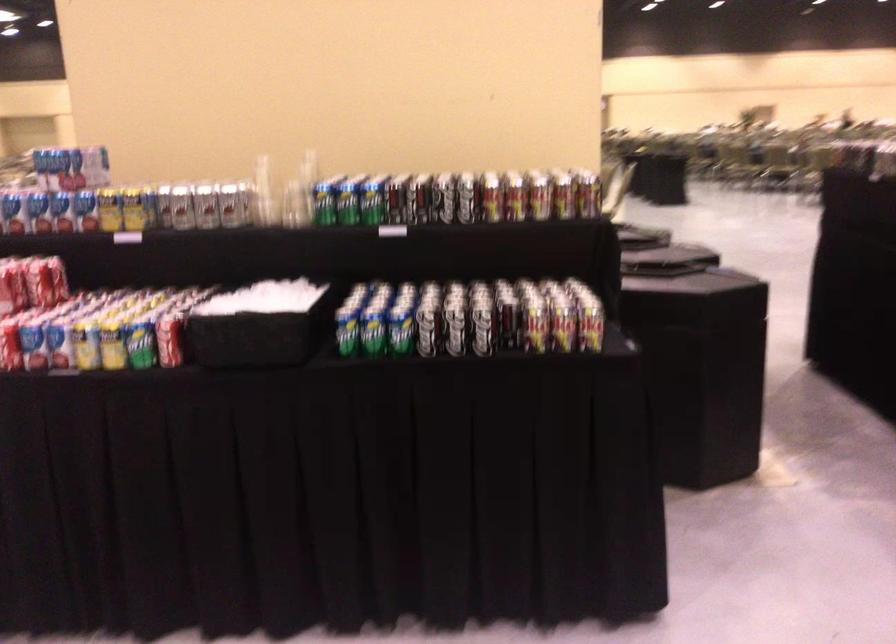
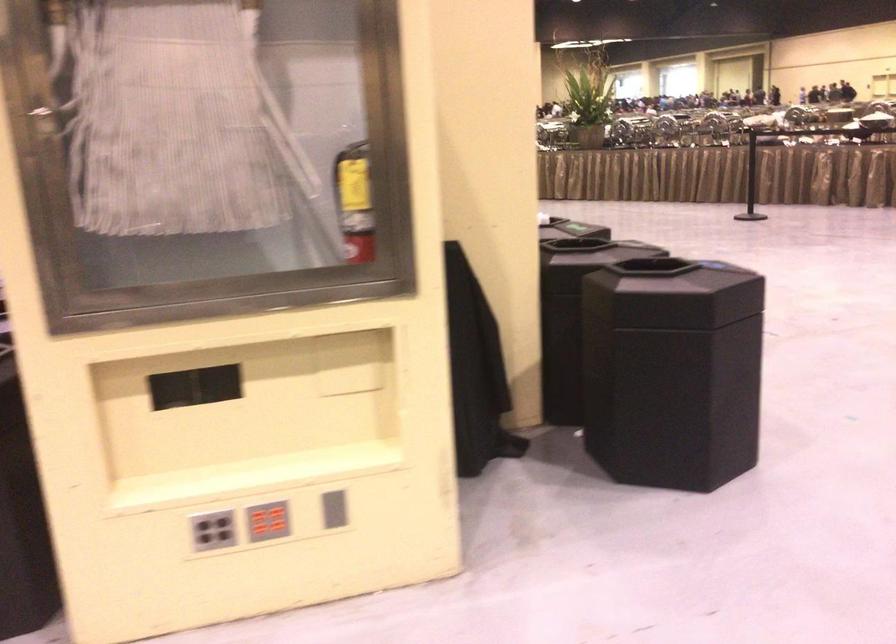
Question: I am providing you with two images of the same scene from different viewpoints. After the viewpoint changes to image2, which objects are now occluded?

Choices:
 (A) grey vertical slot
 (B) grey button panel
 (C) disposable cup
 (D) silver soda can

Answer: (D)